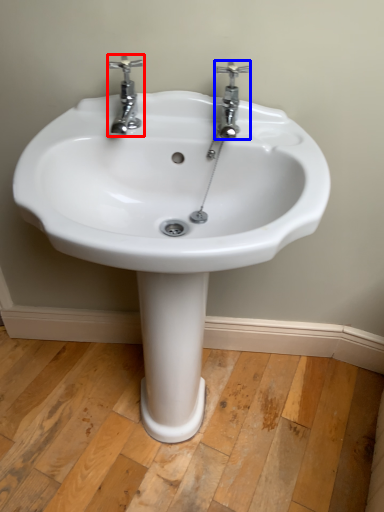
Question: Which object is closer to the camera taking this photo, tap (highlighted by a red box) or tap (highlighted by a blue box)?

Choices:
 (A) tap
 (B) tap

Answer: (A)